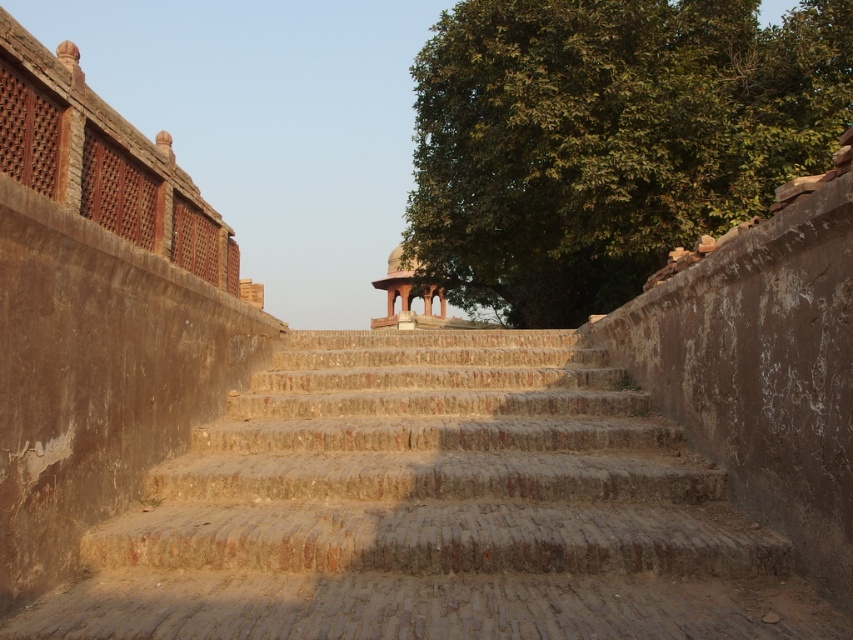
Question: Which point is closer to the camera?

Choices:
 (A) brown stone stairs at center
 (B) matte stone gazebo at center

Answer: (A)

Question: Which point is farther to the camera?

Choices:
 (A) brown stone stairs at center
 (B) matte stone gazebo at center

Answer: (B)

Question: Is brown stone stairs at center to the left of matte stone gazebo at center from the viewer's perspective?

Choices:
 (A) no
 (B) yes

Answer: (A)

Question: Can you confirm if brown stone stairs at center is positioned to the right of matte stone gazebo at center?

Choices:
 (A) no
 (B) yes

Answer: (B)

Question: Does brown stone stairs at center have a greater width compared to matte stone gazebo at center?

Choices:
 (A) no
 (B) yes

Answer: (A)